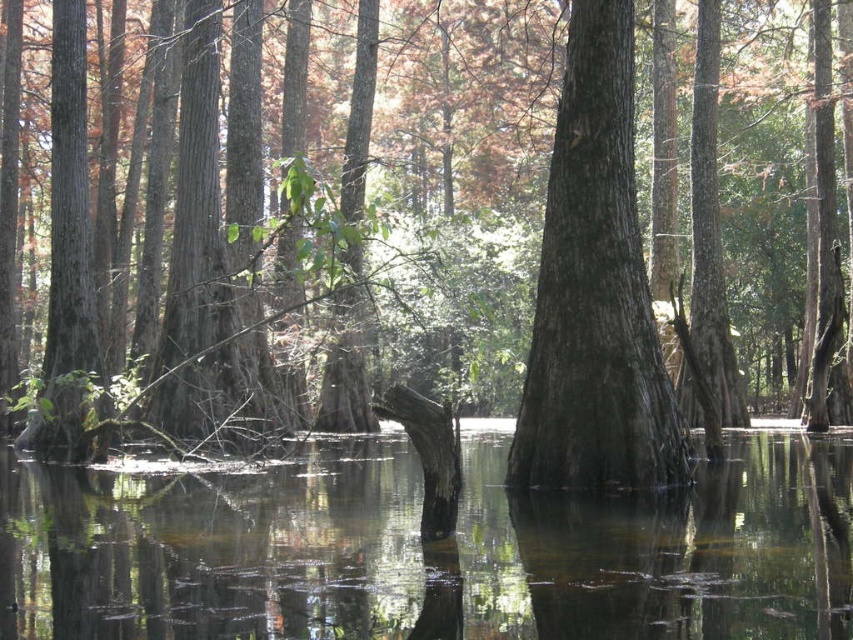
Can you confirm if clear water at center is positioned below smooth dark brown tree trunk at center?

Indeed, clear water at center is positioned under smooth dark brown tree trunk at center.

Is clear water at center positioned behind smooth dark brown tree trunk at center?

No, clear water at center is in front of smooth dark brown tree trunk at center.

Is point (120, 630) positioned in front of point (538, 289)?

Yes, point (120, 630) is in front of point (538, 289).

Where is `clear water at center`? Image resolution: width=853 pixels, height=640 pixels. clear water at center is located at coordinates (425, 552).